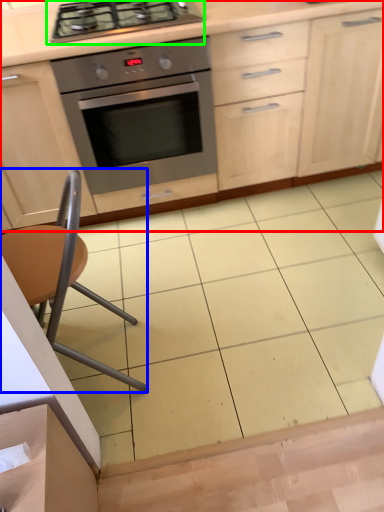
Question: Based on their relative distances, which object is farther from cabinetry (highlighted by a red box)? Choose from chair (highlighted by a blue box) and gas stove (highlighted by a green box).

Choices:
 (A) chair
 (B) gas stove

Answer: (A)